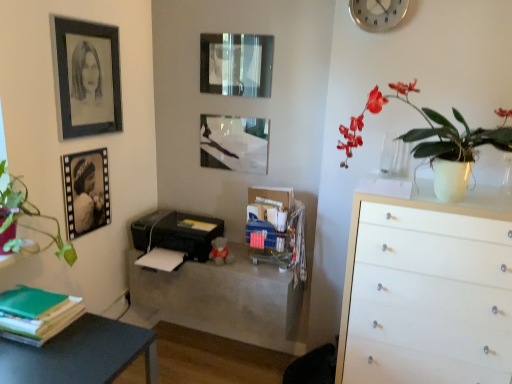
Question: From a real-world perspective, is green matte book at lower left above or below matte black printer at center?

Choices:
 (A) below
 (B) above

Answer: (B)

Question: In the image, is green matte book at lower left positioned in front of or behind matte black printer at center?

Choices:
 (A) front
 (B) behind

Answer: (A)

Question: Based on their relative distances, which object is farther from the white wood chest of drawers at right?

Choices:
 (A) matte black printer at center
 (B) matte white vase at upper right
 (C) matte black picture frame at upper center, placed as the first picture frame when sorted from right to left
 (D) black plastic printer at center
 (E) matte black picture frame at center, which appears as the second picture frame when viewed from the right

Answer: (C)

Question: Estimate the real-world distances between objects in this image. Which object is farther from the matte black picture frame at center, which appears as the second picture frame when viewed from the right?

Choices:
 (A) matte black picture frame at upper center, marked as the fourth picture frame in a left-to-right arrangement
 (B) matte black printer at center
 (C) silver metallic clock at upper right
 (D) white wood chest of drawers at right
 (E) black plastic printer at center

Answer: (D)